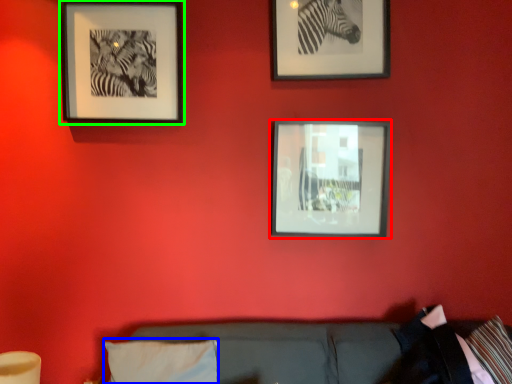
Question: Based on their relative distances, which object is farther from picture frame (highlighted by a red box)? Choose from pillow (highlighted by a blue box) and picture frame (highlighted by a green box).

Choices:
 (A) pillow
 (B) picture frame

Answer: (A)